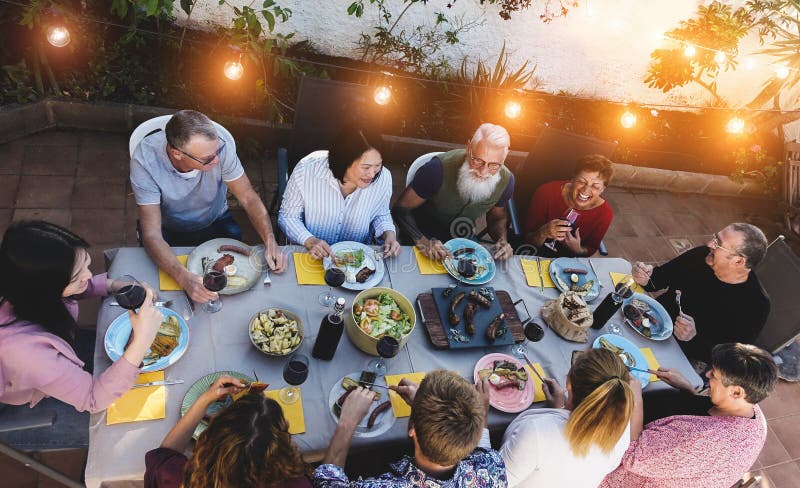
You are a GUI agent. You are given a task and a screenshot of the screen. Output one action in this format:
    pyautogui.click(x=<x>, y=<y>)
    Task: Click on the yellow napkins
    The height and width of the screenshot is (488, 800).
    Given the screenshot: What is the action you would take?
    pyautogui.click(x=130, y=406), pyautogui.click(x=168, y=280), pyautogui.click(x=302, y=275), pyautogui.click(x=293, y=411), pyautogui.click(x=429, y=267), pyautogui.click(x=401, y=406), pyautogui.click(x=530, y=270), pyautogui.click(x=537, y=384), pyautogui.click(x=618, y=275), pyautogui.click(x=650, y=357)